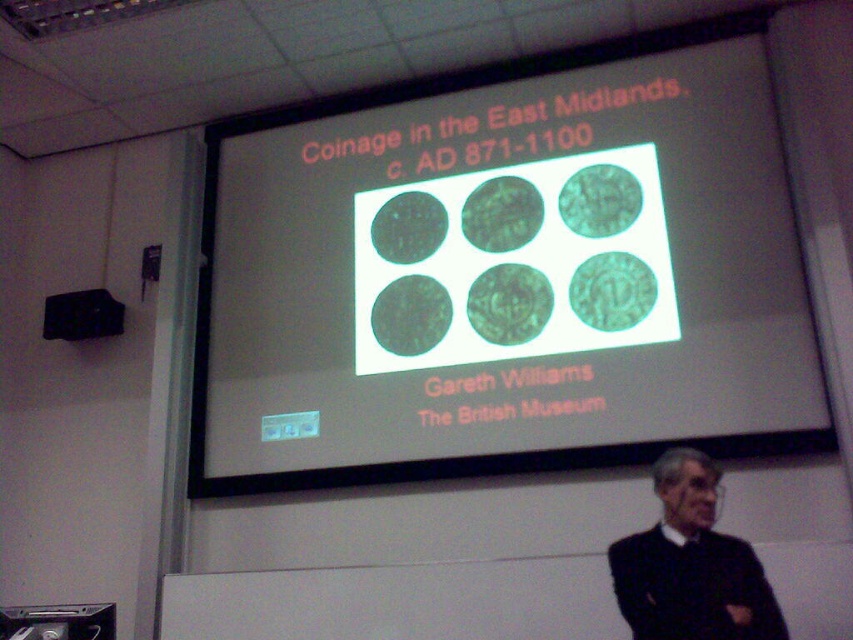
Does black fabric at lower right have a lesser height compared to black plastic speaker at upper left?

Incorrect, black fabric at lower right's height does not fall short of black plastic speaker at upper left's.

I want to click on black fabric at lower right, so click(691, 564).